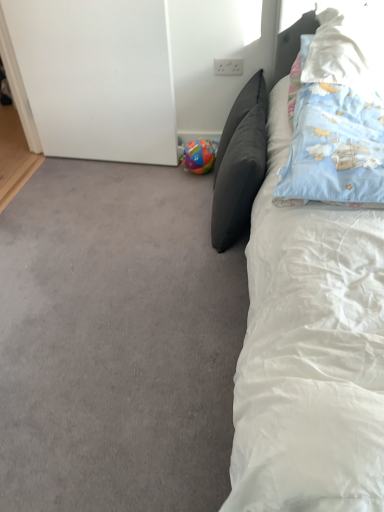
Locate an element on the screen. vacant area on the back side of dark gray cushion at center, positioned as the third pillow in right-to-left order is located at coordinates point(185,188).